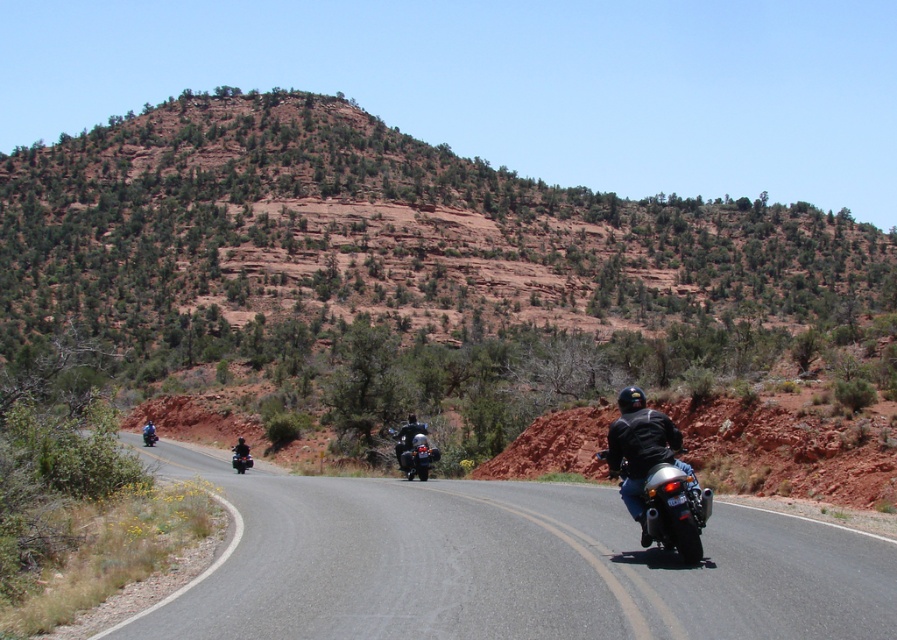
Consider the image. Between shiny chrome motorcycle at right and dark gray leather jacket at center, which one is positioned lower?

Positioned lower is dark gray leather jacket at center.

Does shiny chrome motorcycle at right have a greater width compared to dark gray leather jacket at center?

In fact, shiny chrome motorcycle at right might be narrower than dark gray leather jacket at center.

Is point (695, 492) farther from camera compared to point (238, 451)?

No, it is not.

Where is `shiny chrome motorcycle at right`? Image resolution: width=897 pixels, height=640 pixels. shiny chrome motorcycle at right is located at coordinates click(675, 512).

Looking at this image, which is above, shiny black motorcycle at center or blue leather jacket at center?

shiny black motorcycle at center is above.

The height and width of the screenshot is (640, 897). In order to click on shiny black motorcycle at center in this screenshot , I will do `click(414, 451)`.

Locate an element on the screen. Image resolution: width=897 pixels, height=640 pixels. shiny black motorcycle at center is located at coordinates (414, 451).

Who is more distant from viewer, [663,499] or [405,445]?

The point [405,445] is more distant.

Who is more distant from viewer, (672, 531) or (394, 432)?

The point (394, 432) is more distant.

Find the location of a particular element. This screenshot has width=897, height=640. shiny chrome motorcycle at right is located at coordinates (675, 512).